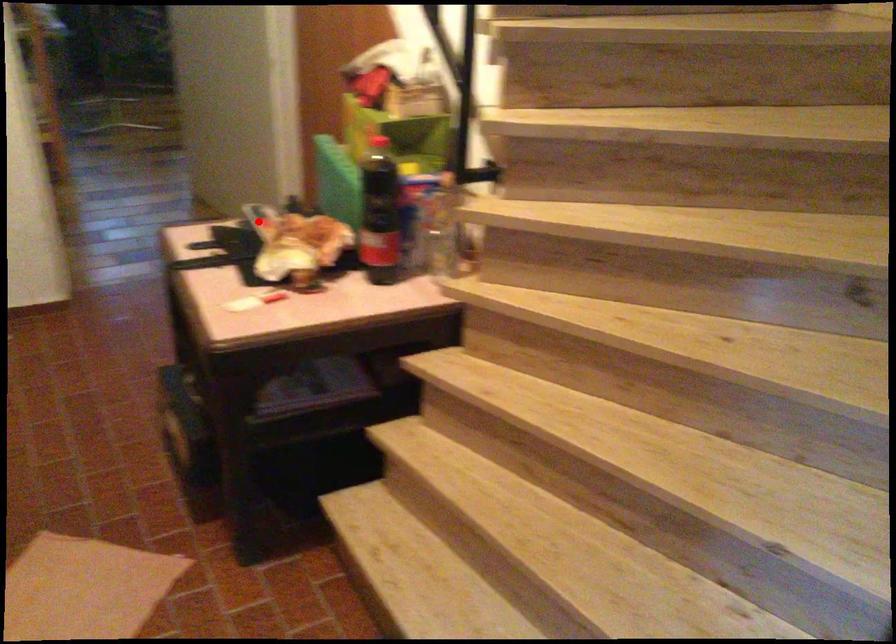
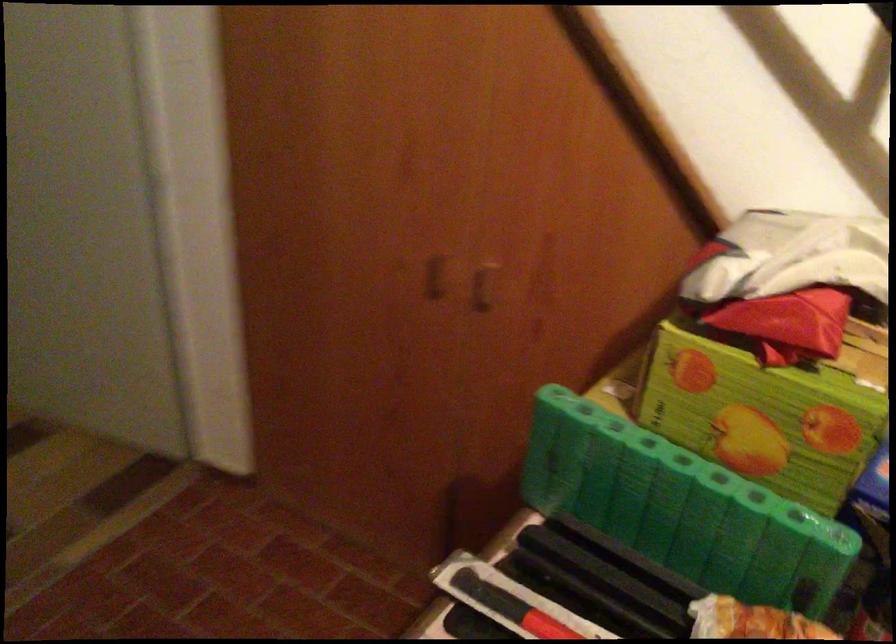
Question: A red point is marked in image1. In image2, is the corresponding 3D point closer to the camera or farther? Reply with the corresponding letter.

Choices:
 (A) The corresponding 3D point is closer.
 (B) The corresponding 3D point is farther.

Answer: (A)